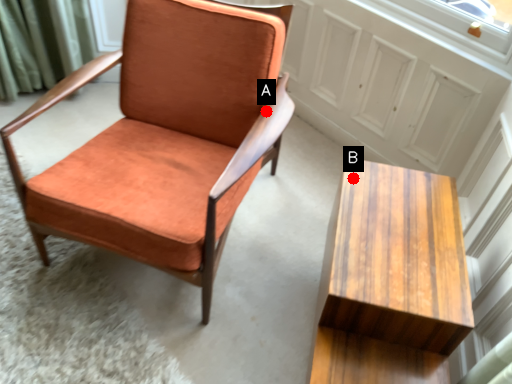
Question: Two points are circled on the image, labeled by A and B beside each circle. Which point is closer to the camera?

Choices:
 (A) A is closer
 (B) B is closer

Answer: (B)